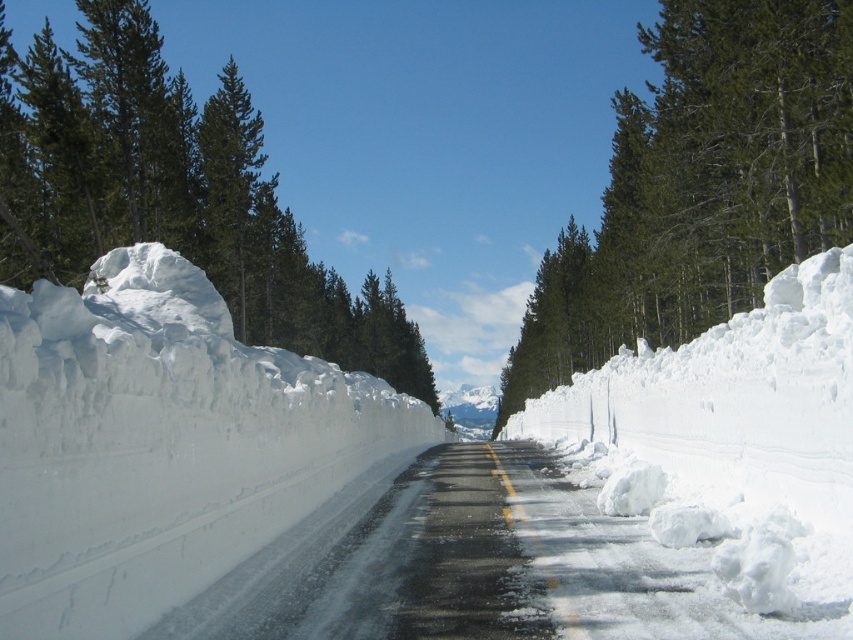
You are driving a car and see the white fluffy snow at left and the white fluffy snow at center. Which one is higher in elevation?

The white fluffy snow at left is higher in elevation than the white fluffy snow at center.

Looking at this image, you are driving a car with a 4.2 meter turning radius and need to make a sharp turn onto a side road that branches off to the left. There is white fluffy snow at left. Can your car make the turn without hitting the snow?

The white fluffy snow at left is 4.54 meters away from the viewer. Since your car has a 4.2 meter turning radius, which is smaller than the distance to the snow, you can make the turn without hitting it.

Consider the image. You are driving a car and see the road ahead with white fluffy snow at center and green matte tree at upper center. According to the scene description, which object is positioned to the left of the other?

The white fluffy snow at center is to the left of the green matte tree at upper center.